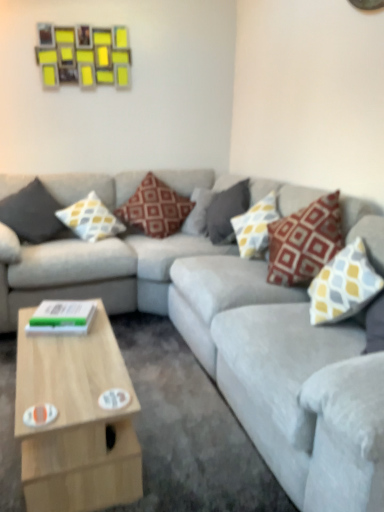
In order to click on vacant area to the right of light wood coffee table at lower left in this screenshot , I will do `click(188, 434)`.